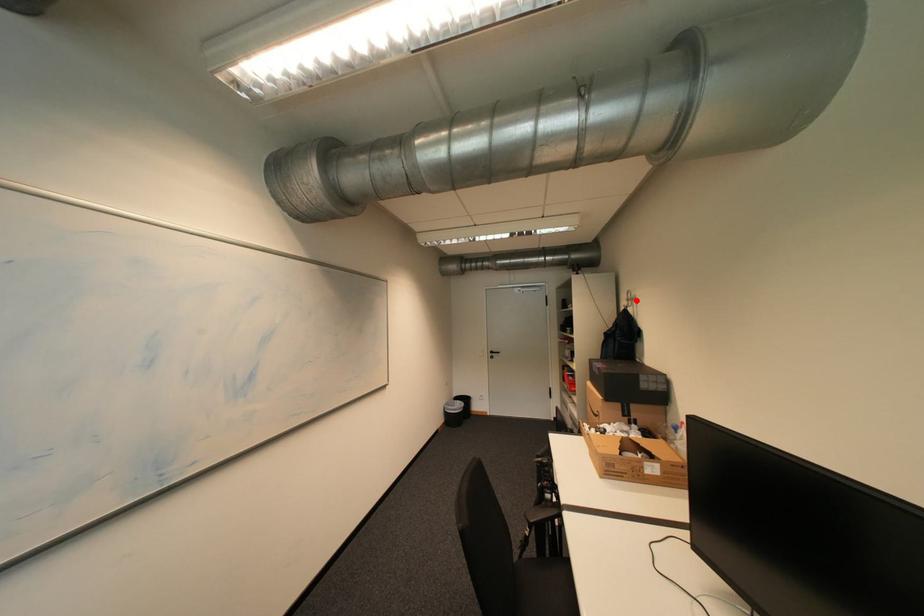
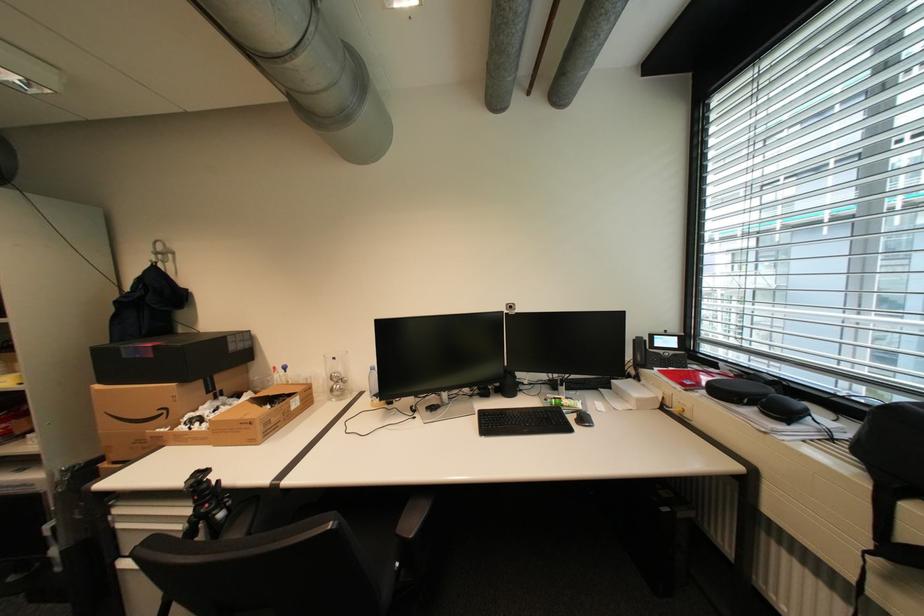
Question: I am providing you with two images of the same scene from different viewpoints. A red point is marked on the first image. At the location where the point appears in image 1, is it still visible in image 2?

Choices:
 (A) Yes
 (B) No

Answer: (A)